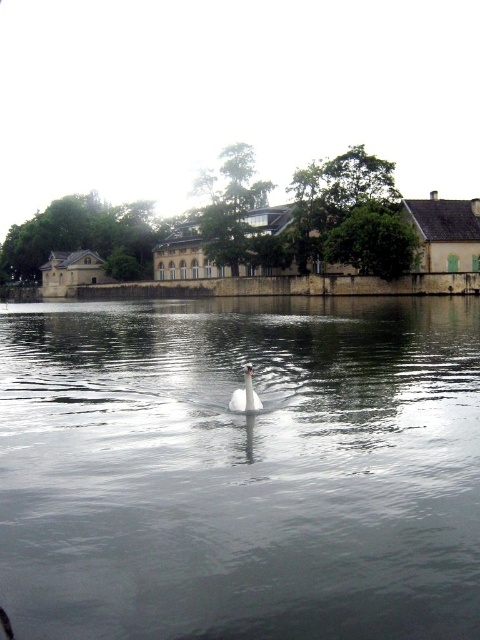
You are standing on the lakeside and see the clear water at center and the white glossy swan at center. Which object is positioned higher from the ground?

The clear water at center is above the white glossy swan at center, so the clear water at center is higher from the ground.

Looking at this image, you are standing at the lakeside and want to take a photo of the white glossy swan at center. Since the clear water at center is reflecting the swan, will the reflection of the swan be visible in the photo?

The clear water at center is in front of the white glossy swan at center, so the reflection of the white glossy swan at center would be visible in the clear water at center, making it visible in the photo.